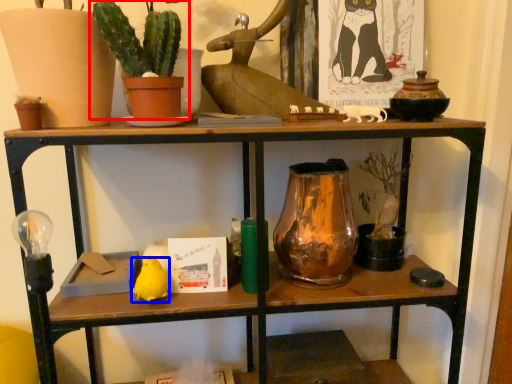
Question: Which object appears farthest to the camera in this image, houseplant (highlighted by a red box) or animal (highlighted by a blue box)?

Choices:
 (A) houseplant
 (B) animal

Answer: (B)